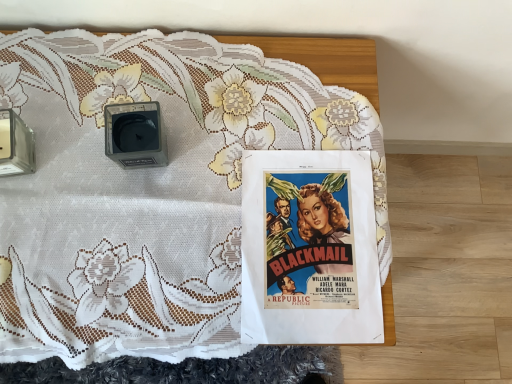
At what (x,y) coordinates should I click in order to perform the action: click on vacant area situated to the left side of vivid paper poster at center. Please return your answer as a coordinate pair (x, y). The height and width of the screenshot is (384, 512). Looking at the image, I should click on (174, 230).